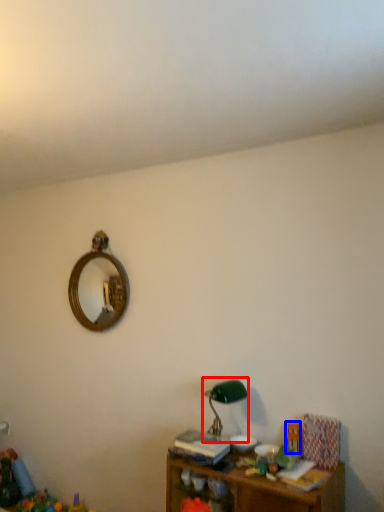
Question: Which object appears closest to the camera in this image, table lamp (highlighted by a red box) or toy (highlighted by a blue box)?

Choices:
 (A) table lamp
 (B) toy

Answer: (A)